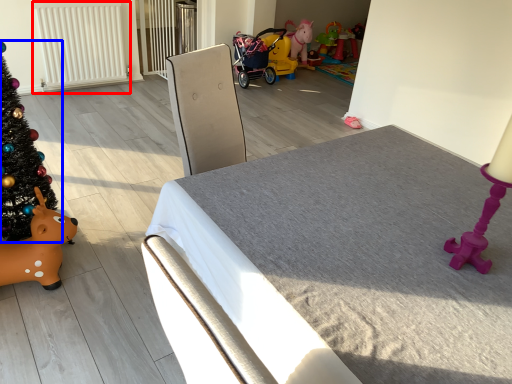
Question: Which object is closer to the camera taking this photo, radiator (highlighted by a red box) or christmas tree (highlighted by a blue box)?

Choices:
 (A) radiator
 (B) christmas tree

Answer: (B)